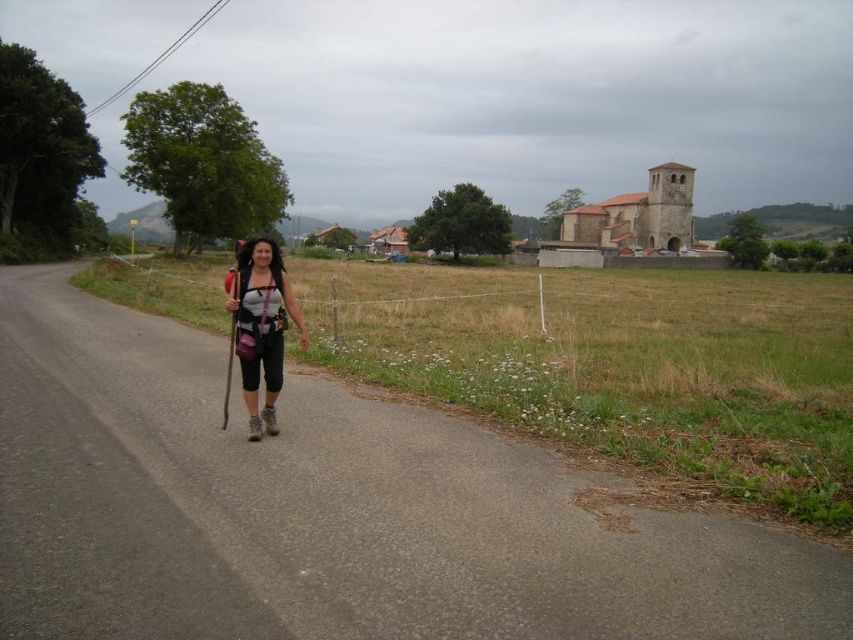
Question: Is gray asphalt road at center further to camera compared to wooden ski pole at center?

Choices:
 (A) yes
 (B) no

Answer: (B)

Question: Which object is farther from the camera taking this photo?

Choices:
 (A) matte black backpack at center
 (B) gray asphalt road at center

Answer: (A)

Question: Can you confirm if matte black backpack at center is positioned to the right of wooden ski pole at center?

Choices:
 (A) yes
 (B) no

Answer: (A)

Question: Is gray asphalt road at center thinner than wooden ski pole at center?

Choices:
 (A) yes
 (B) no

Answer: (A)

Question: Which point appears closest to the camera in this image?

Choices:
 (A) (223, 394)
 (B) (225, 586)
 (C) (297, 320)

Answer: (B)

Question: Estimate the real-world distances between objects in this image. Which object is farther from the gray asphalt road at center?

Choices:
 (A) matte black backpack at center
 (B) wooden ski pole at center

Answer: (B)